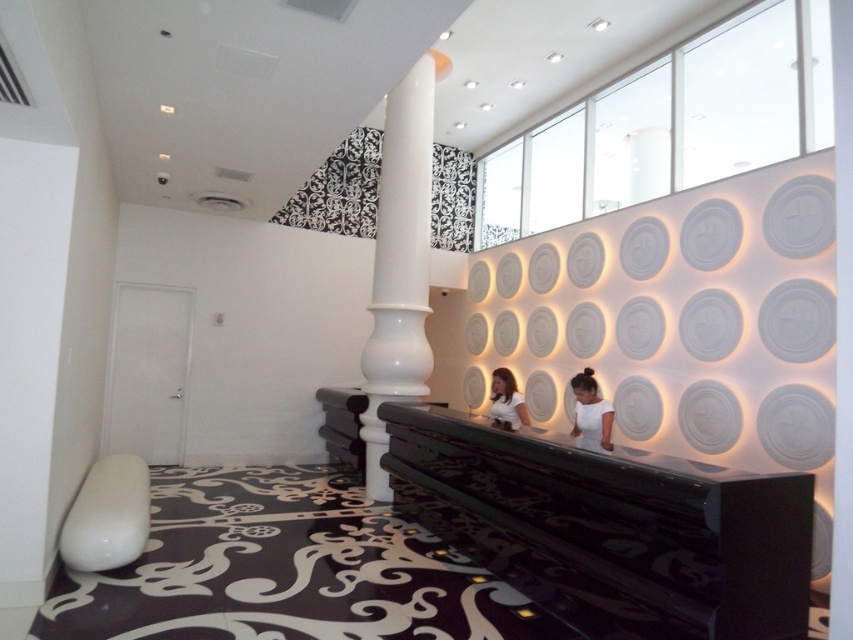
Is black glossy balustrade at center closer to the viewer compared to white glossy shirt at center?

Yes, it is.

Can you confirm if black glossy balustrade at center is positioned to the left of white glossy shirt at center?

Correct, you'll find black glossy balustrade at center to the left of white glossy shirt at center.

Between point (605, 561) and point (498, 410), which one is positioned behind?

The point (498, 410) is more distant.

Where is `black glossy balustrade at center`? The height and width of the screenshot is (640, 853). black glossy balustrade at center is located at coordinates (627, 516).

This screenshot has height=640, width=853. Find the location of `white matte shirt at center`. white matte shirt at center is located at coordinates (590, 410).

Is white matte shirt at center to the left of white glossy shirt at center from the viewer's perspective?

In fact, white matte shirt at center is to the right of white glossy shirt at center.

I want to click on white matte shirt at center, so click(x=590, y=410).

Which is more to the right, white glossy column at center or white matte shirt at center?

From the viewer's perspective, white matte shirt at center appears more on the right side.

Can you confirm if white glossy column at center is taller than white matte shirt at center?

Indeed, white glossy column at center has a greater height compared to white matte shirt at center.

The image size is (853, 640). Identify the location of white glossy column at center. (399, 262).

Identify the location of white glossy column at center. The width and height of the screenshot is (853, 640). (399, 262).